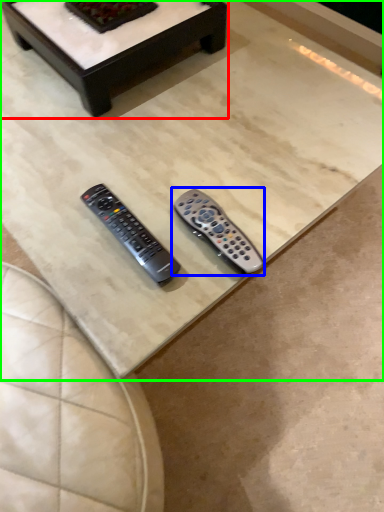
Question: Considering the real-world distances, which object is farthest from coffee table (highlighted by a red box)? remote control (highlighted by a blue box) or coffee table (highlighted by a green box)?

Choices:
 (A) remote control
 (B) coffee table

Answer: (A)